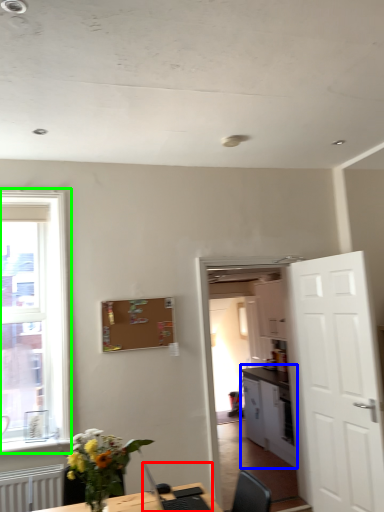
Question: Which object is positioned closest to computer (highlighted by a red box)? Select from cabinetry (highlighted by a blue box) and window (highlighted by a green box).

Choices:
 (A) cabinetry
 (B) window

Answer: (B)